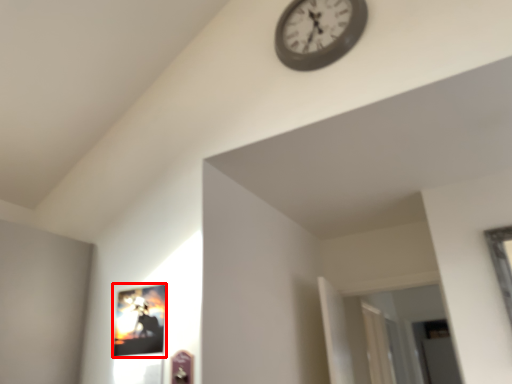
Question: From the image, what is the correct spatial relationship of picture frame (annotated by the red box) in relation to wall clock?

Choices:
 (A) left
 (B) right

Answer: (A)